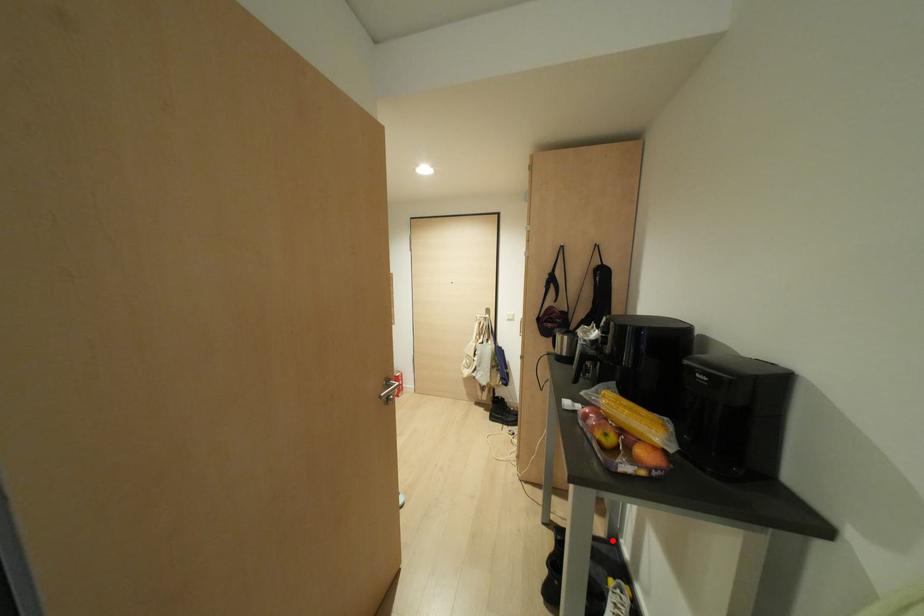
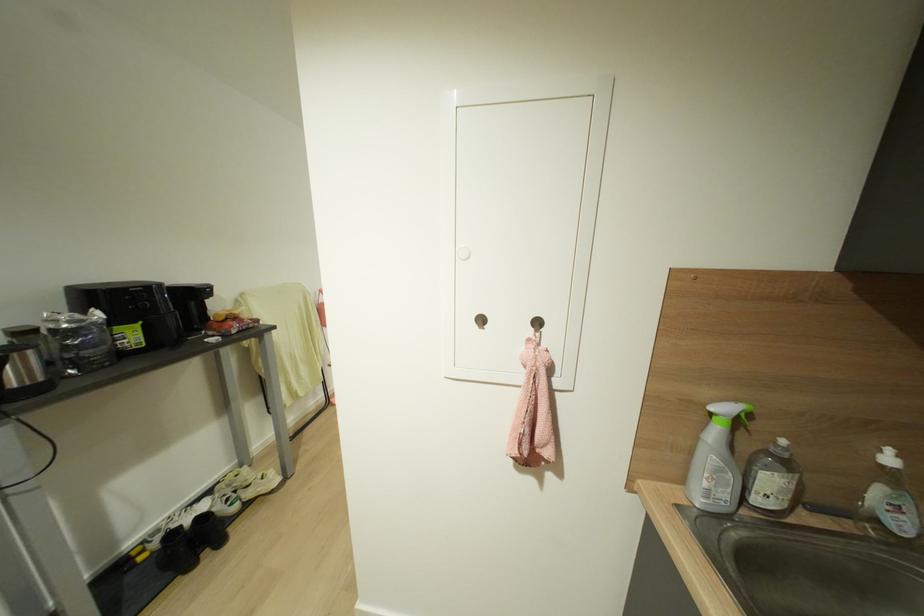
Question: I am providing you with two images of the same scene from different viewpoints. A red point is marked on the first image. At the location where the point appears in image 1, is it still visible in image 2?

Choices:
 (A) Yes
 (B) No

Answer: (B)